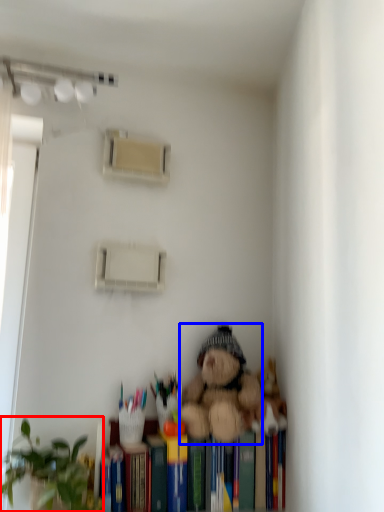
Question: Which object appears closest to the camera in this image, houseplant (highlighted by a red box) or teddy bear (highlighted by a blue box)?

Choices:
 (A) houseplant
 (B) teddy bear

Answer: (A)